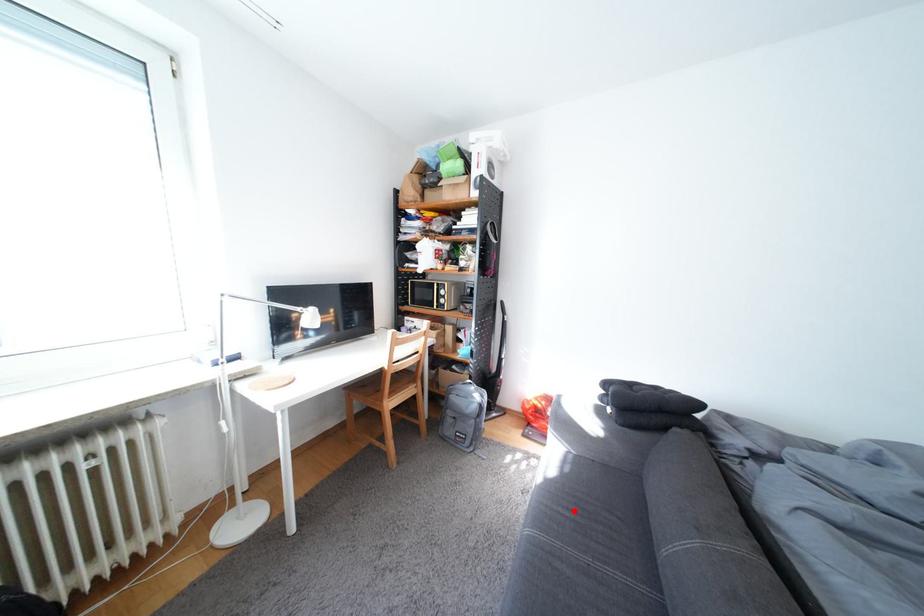
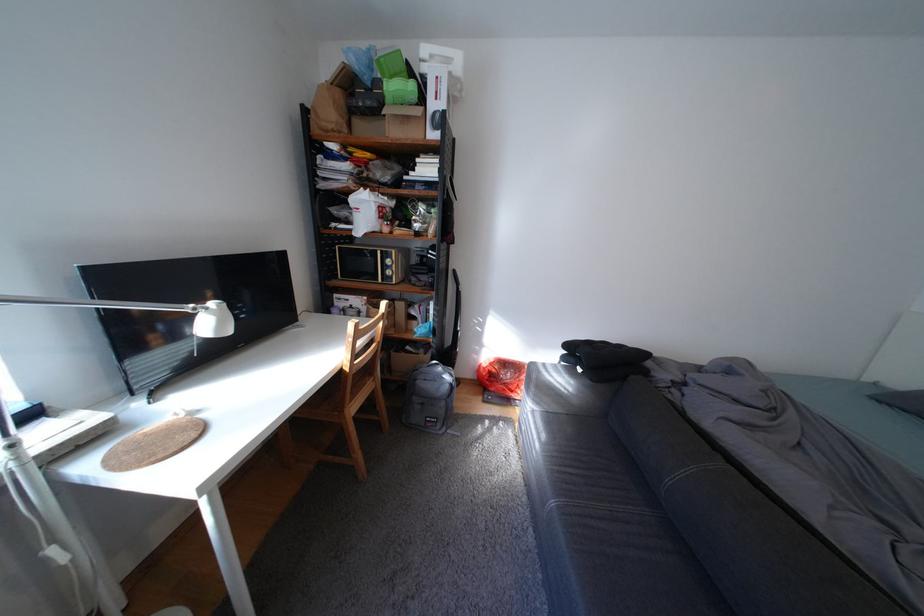
Where in the second image is the point corresponding to the highlighted location from the first image?

(582, 471)